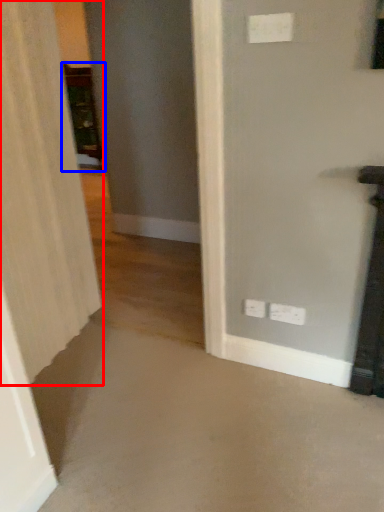
Question: Among these objects, which one is nearest to the camera, curtain (highlighted by a red box) or furniture (highlighted by a blue box)?

Choices:
 (A) curtain
 (B) furniture

Answer: (A)